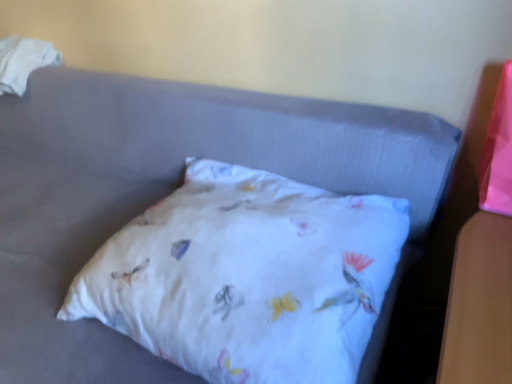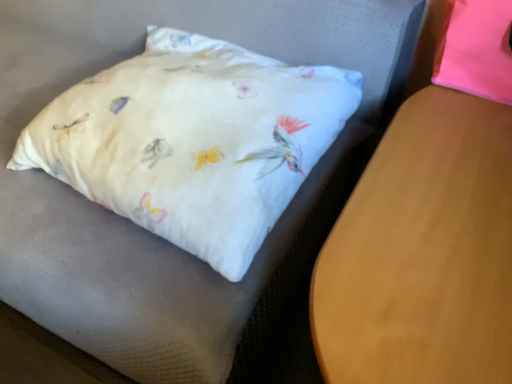
Question: How did the camera likely rotate when shooting the video?

Choices:
 (A) rotated downward
 (B) rotated upward

Answer: (A)